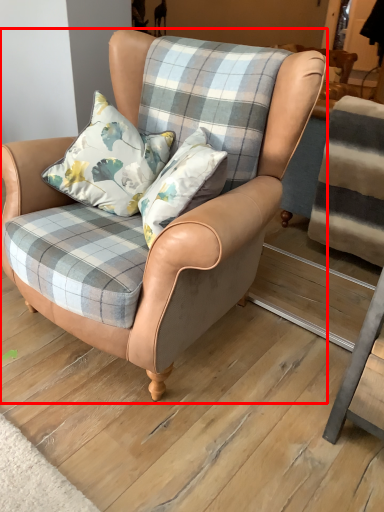
Question: Observing the image, what is the correct spatial positioning of chair (annotated by the red box) in reference to pillow?

Choices:
 (A) left
 (B) right

Answer: (B)